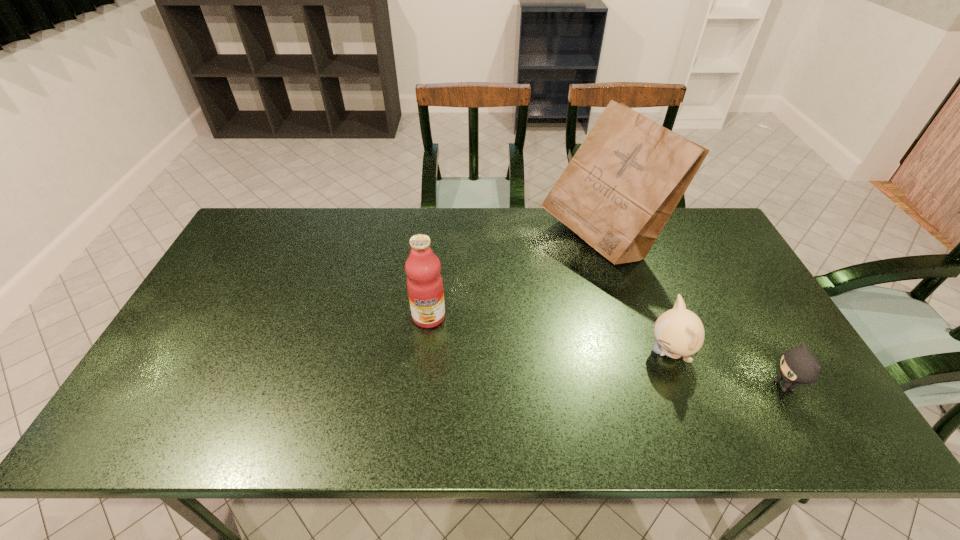
Where is `the tallest object`? This screenshot has width=960, height=540. the tallest object is located at coordinates (617, 193).

This screenshot has width=960, height=540. I want to click on grocery bag, so click(x=617, y=193).

At what (x,y) coordinates should I click in order to perform the action: click on the third nearest object. Please return your answer as a coordinate pair (x, y). Looking at the image, I should click on (424, 282).

Locate an element on the screen. the third shortest object is located at coordinates (424, 282).

Where is `the left kitten`? Image resolution: width=960 pixels, height=540 pixels. the left kitten is located at coordinates (679, 332).

Locate an element on the screen. The width and height of the screenshot is (960, 540). the second shortest object is located at coordinates (679, 332).

What are the coordinates of `the shortest object` in the screenshot? It's located at coord(798,366).

Locate an element on the screen. This screenshot has width=960, height=540. the right kitten is located at coordinates (798, 366).

You are a GUI agent. You are given a task and a screenshot of the screen. Output one action in this format:
    pyautogui.click(x=<x>, y=<y>)
    Task: Click on the vacant space located on the left of the farthest object
    
    Given the screenshot: What is the action you would take?
    pyautogui.click(x=455, y=241)

Where is `free space located on the label of the third nearest object`? This screenshot has height=540, width=960. free space located on the label of the third nearest object is located at coordinates (425, 351).